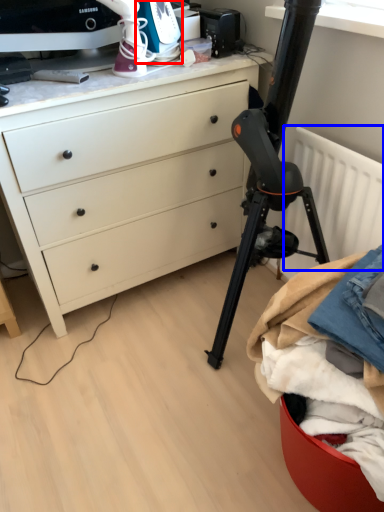
Question: Which of the following is the farthest to the observer, appliance (highlighted by a red box) or radiator (highlighted by a blue box)?

Choices:
 (A) appliance
 (B) radiator

Answer: (A)